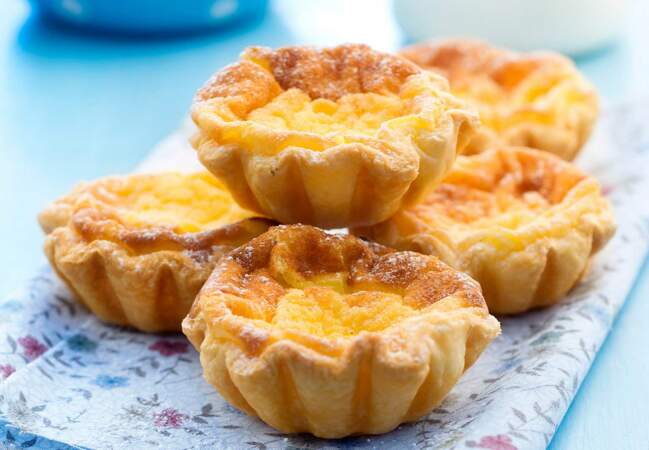
At what (x,y) coordinates should I click in order to perform the action: click on bowls. Please return your answer as a coordinate pair (x, y). The image size is (649, 450). Looking at the image, I should click on (198, 12), (532, 28).